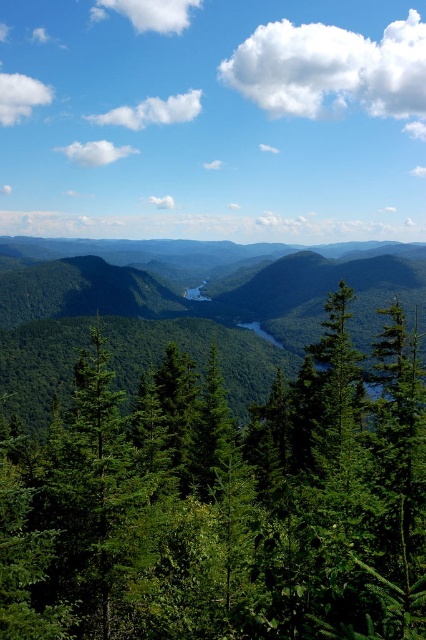
You are standing at the point marked by coordinates point [224,500] in the image. Looking around, you see a dense forest of coniferous trees in the foreground and a winding river in the midground. Which direction should you walk to reach the river?

The point [224,500] corresponds to the green matte tree at center. Since the river is in the midground and the tree is at the center, you should walk towards the midground direction to reach the river.

You are an environmental scientist studying the mountain ecosystem. You observe the green matte tree at center and the green matte forest at center in the image. Which of these two has a larger overall size?

The green matte forest at center has a larger overall size than the green matte tree at center.